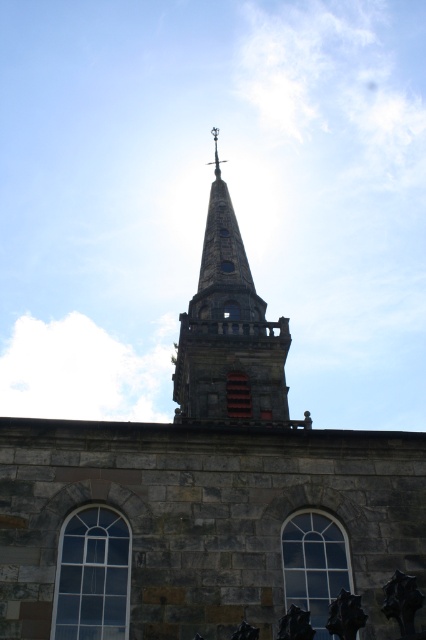
You are standing at the base of the historic stone building. You want to take a photo of the stone steeple at upper center. If your camera can focus on objects up to 50 meters away, will it be able to capture the steeple clearly?

The stone steeple at upper center and camera are 55.92 meters apart, so the camera cannot focus on the steeple since it is beyond the 50 meters range.

You are standing in front of a historic stone building. There is a point marked at coordinates (229, 332). What does this point indicate?

The point at coordinates (229, 332) marks the stone steeple at upper center of the building.

You are an architect assessing the building for renovations. You need to determine if the stone steeple at upper center can support a new decorative element. Based on its height compared to the clear glass window at center, what can you infer about the steeple?

The stone steeple at upper center is much taller than the clear glass window at center, indicating it has a robust structural foundation capable of supporting additional weight.